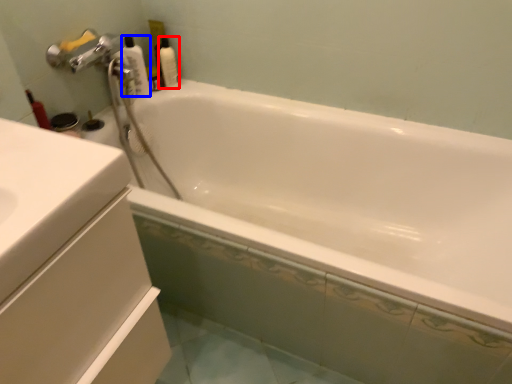
Question: Among these objects, which one is farthest to the camera, cleaning product (highlighted by a red box) or cleaning product (highlighted by a blue box)?

Choices:
 (A) cleaning product
 (B) cleaning product

Answer: (A)